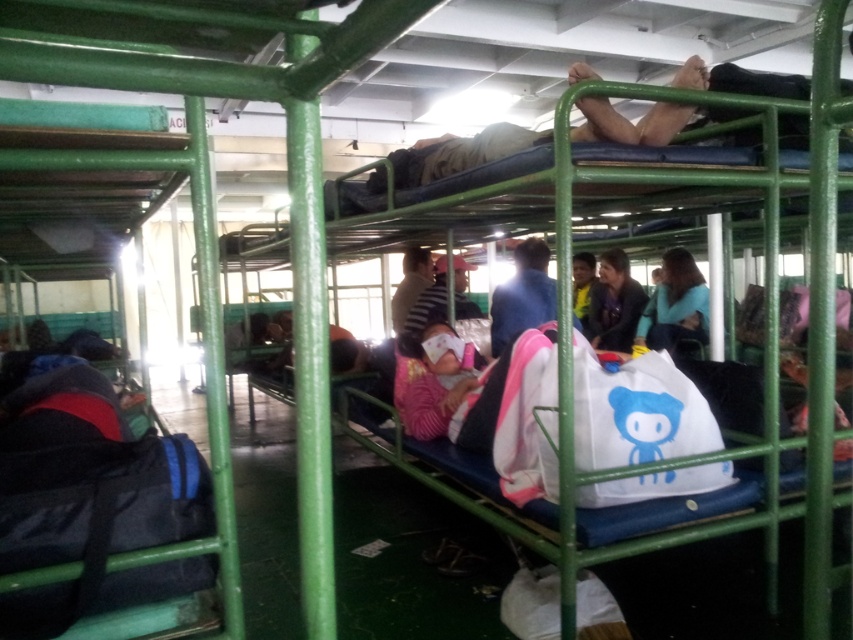
Question: Considering the real-world distances, which object is farthest from the light brown fabric at upper center?

Choices:
 (A) blue matte shirt at center
 (B) pink knitted sweater at center
 (C) matte black jacket at center
 (D) striped fabric shirt at center

Answer: (C)

Question: Is light brown fabric at upper center bigger than striped fabric shirt at center?

Choices:
 (A) no
 (B) yes

Answer: (B)

Question: Which of these objects is positioned closest to the striped fabric shirt at center?

Choices:
 (A) pink knitted sweater at center
 (B) light brown fabric at upper center
 (C) matte black jacket at center

Answer: (A)

Question: Considering the relative positions of matte black jacket at center and striped fabric shirt at center in the image provided, where is matte black jacket at center located with respect to striped fabric shirt at center?

Choices:
 (A) below
 (B) above

Answer: (B)

Question: Which point is closer to the camera?

Choices:
 (A) (515, 300)
 (B) (444, 381)
 (C) (694, 308)
 (D) (596, 344)

Answer: (B)

Question: Does pink knitted sweater at center appear over striped fabric shirt at center?

Choices:
 (A) no
 (B) yes

Answer: (A)